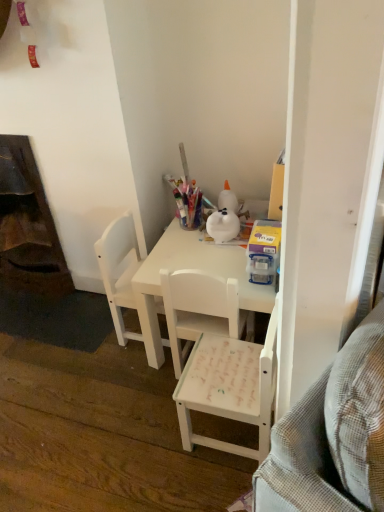
Identify the location of vacant space that is to the left of white matte chair at center, placed as the second chair when sorted from right to left. This screenshot has height=512, width=384. (139, 385).